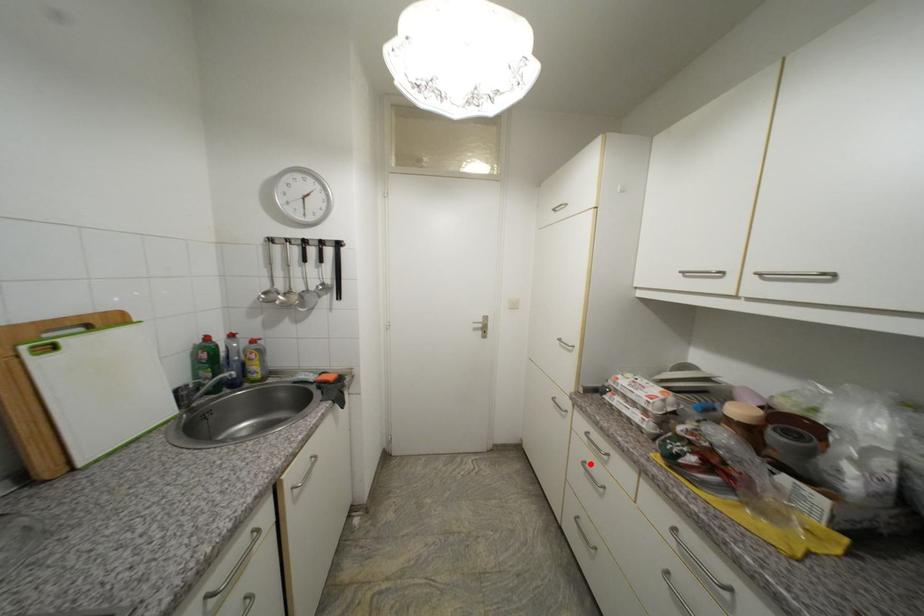
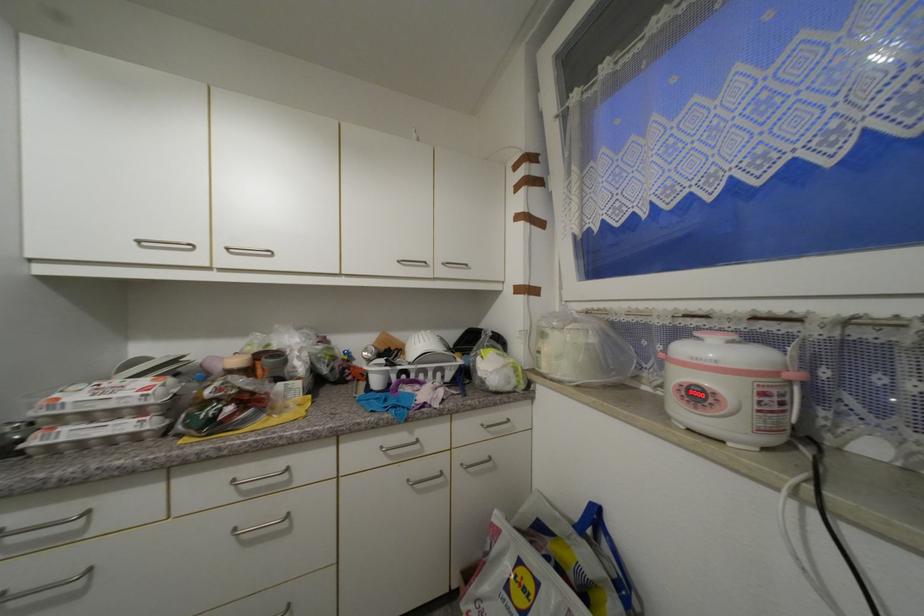
Locate, in the second image, the point that corresponds to the highlighted location in the first image.

(6, 597)